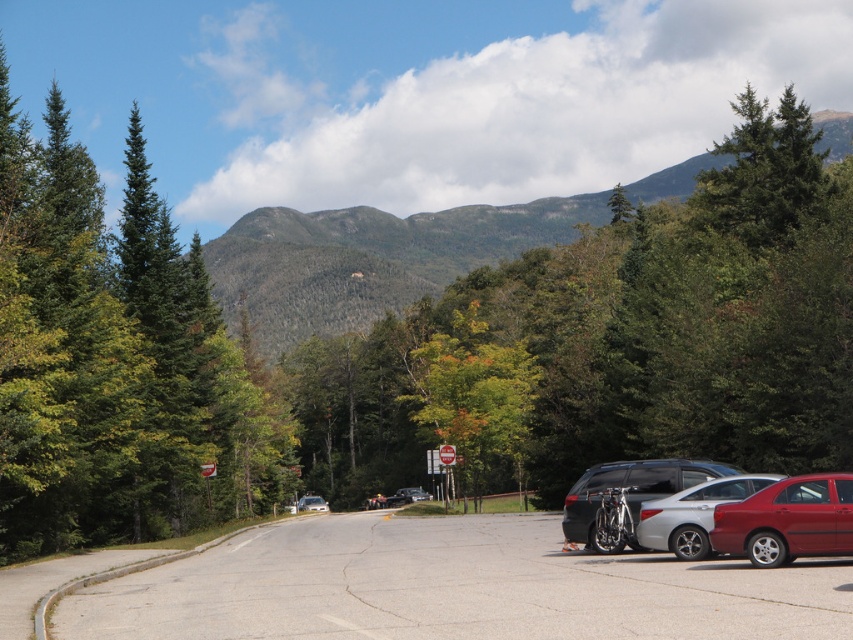
Question: Does gray asphalt parking lot at center have a greater width compared to green leafy tree at center?

Choices:
 (A) yes
 (B) no

Answer: (A)

Question: Is metallic silver car at center-right above metallic silver sedan at center?

Choices:
 (A) no
 (B) yes

Answer: (A)

Question: Which point is closer to the camera taking this photo?

Choices:
 (A) (695, 577)
 (B) (775, 173)
 (C) (483, 356)

Answer: (A)

Question: Which of these objects is positioned farthest from the silver metallic sedan at center?

Choices:
 (A) green evergreen tree at upper right
 (B) gray asphalt parking lot at center
 (C) green forested mountain at upper center
 (D) green leafy tree at center

Answer: (C)

Question: Which of the following is the farthest from the observer?

Choices:
 (A) (321, 506)
 (B) (676, 468)

Answer: (A)

Question: Does green evergreen tree at upper right have a greater width compared to silver metallic sedan at center?

Choices:
 (A) no
 (B) yes

Answer: (B)